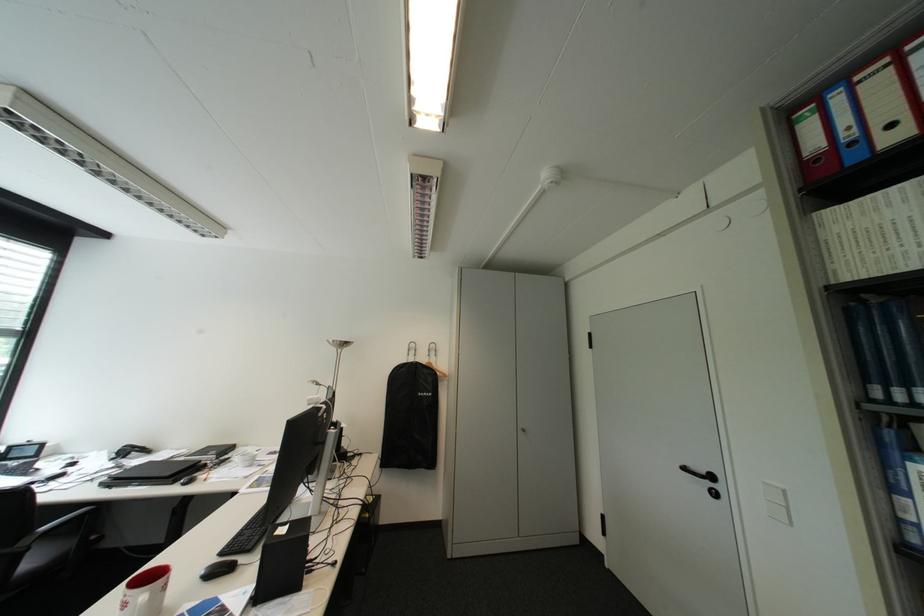
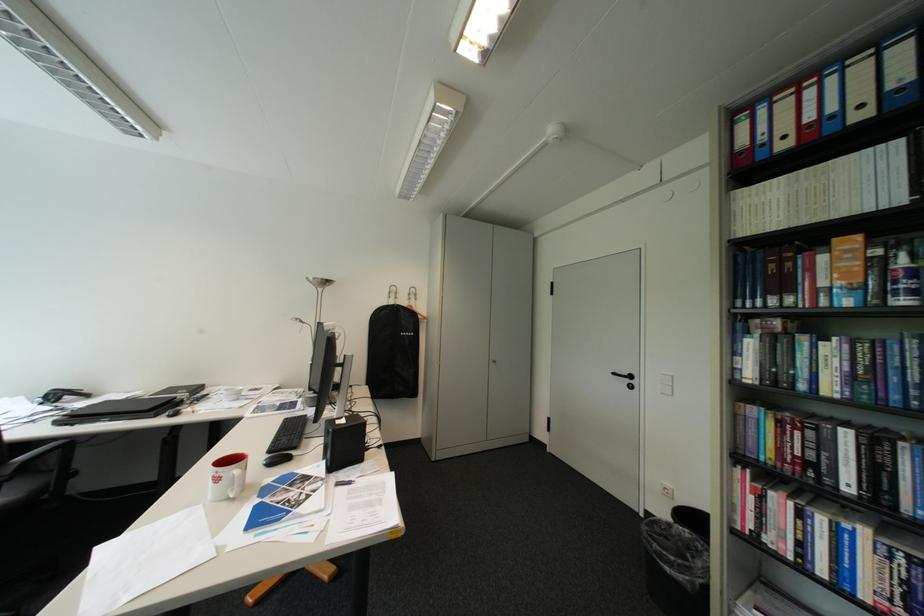
In the second image, find the point that corresponds to (138,452) in the first image.

(67, 397)